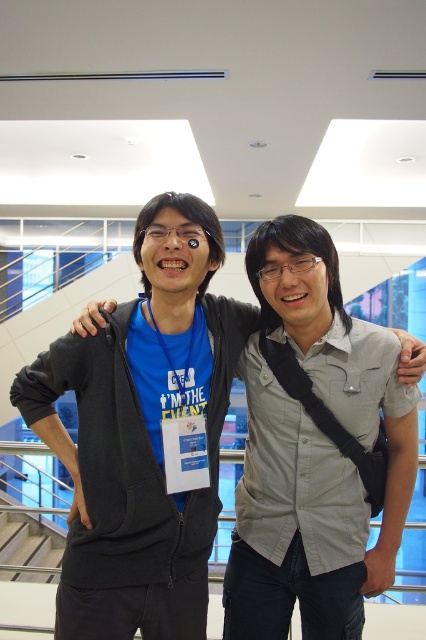
Question: Among these objects, which one is farthest from the camera?

Choices:
 (A) blue cotton t-shirt at center
 (B) gray cotton shirt at center

Answer: (B)

Question: Which object appears farthest from the camera in this image?

Choices:
 (A) gray cotton shirt at center
 (B) blue cotton t-shirt at center

Answer: (A)

Question: Which object appears closest to the camera in this image?

Choices:
 (A) gray cotton shirt at center
 (B) blue cotton t-shirt at center

Answer: (B)

Question: Is blue cotton t-shirt at center positioned behind gray cotton shirt at center?

Choices:
 (A) yes
 (B) no

Answer: (B)

Question: Can you confirm if blue cotton t-shirt at center is positioned to the left of gray cotton shirt at center?

Choices:
 (A) no
 (B) yes

Answer: (B)

Question: Is blue cotton t-shirt at center smaller than gray cotton shirt at center?

Choices:
 (A) yes
 (B) no

Answer: (B)